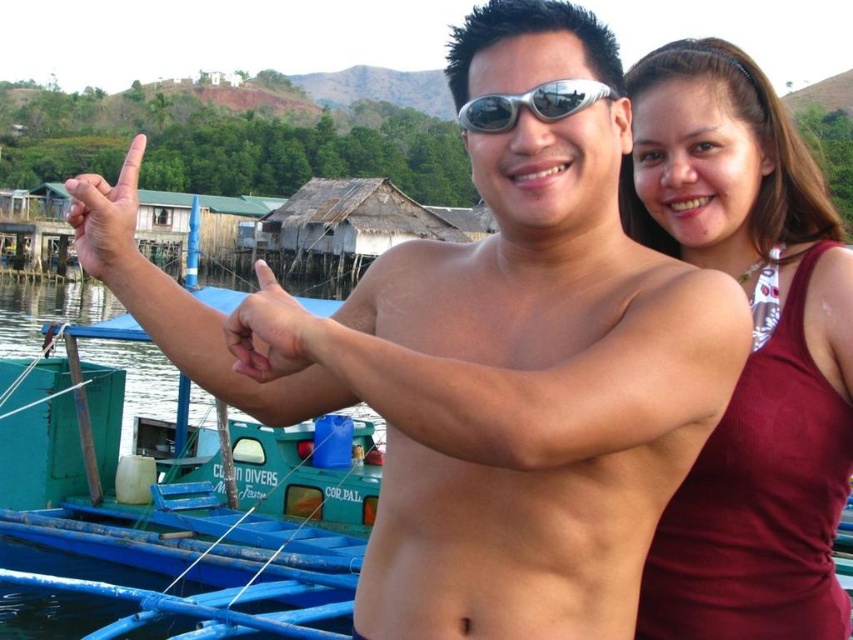
You are a swimmer who needs to retrieve an item from the silver metallic goggles at center while staying near the maroon fabric tank top at right. Given that you can only swim 2 meters, can you reach the goggles without tiring too much?

The distance between maroon fabric tank top at right and silver metallic goggles at center is 3.13 meters. Since you can only swim 2 meters, you cannot reach the goggles without exceeding your swimming limit.

You are a photographer trying to capture a photo of the green plastic boat at left and the matte skin hand at upper left. Since you want both subjects to be in focus, you need to know which one is closer to the camera. Can you determine which one is closer?

The green plastic boat at left might be wider than matte skin hand at upper left, but this doesn t indicate distance. To determine which is closer, look for other clues like focus or size. Since the description doesn t provide distance info, you can t tell for sure.

You are a photographer on a nearby boat. You want to take a photo of the green plastic boat at left without including the matte skin hand at upper left in the shot. Is it possible based on their positions?

The green plastic boat at left is below matte skin hand at upper left, so you can adjust the camera angle downward to exclude the matte skin hand at upper left while capturing the green plastic boat at left.